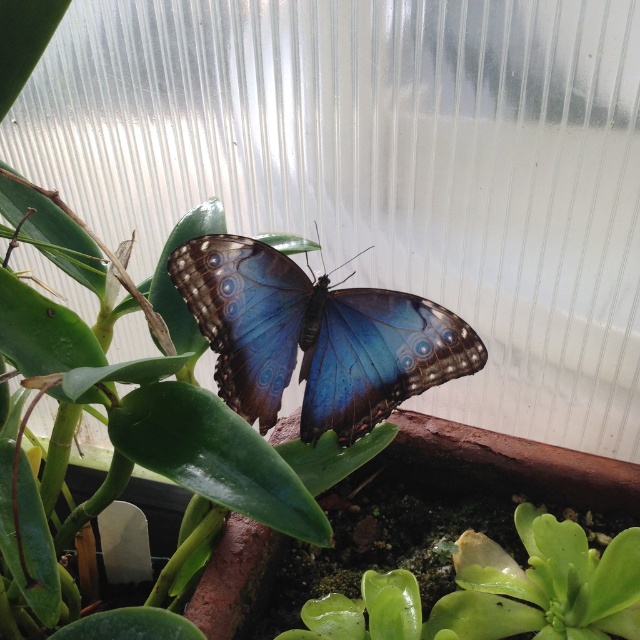
You are a gardener who needs to water the glossy green succulent at bottom right without disturbing the shiny blue butterfly at center. Since the butterfly is above the succulent, which direction should you approach from to water the succulent?

The shiny blue butterfly at center is above the glossy green succulent at bottom right, so you should approach from below the butterfly to water the succulent without disturbing it.

You are observing a terrarium with various plants and a shiny blue butterfly at center. If you want to gently touch the butterfly without disturbing it, which direction should you approach from based on its position?

The shiny blue butterfly at center is located at point coordinates, so you should approach from the direction corresponding to the coordinates to avoid startling it.